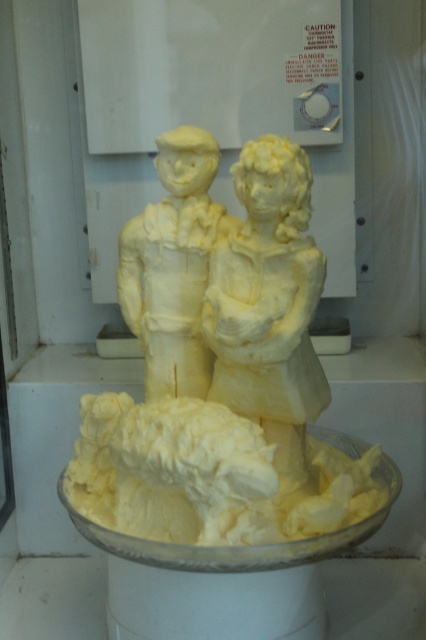
Find the location of a particular element. white creamy icing at lower center is located at coordinates (206, 476).

Can you confirm if white creamy icing at lower center is shorter than buttery yellow sculpture at center?

Indeed, white creamy icing at lower center has a lesser height compared to buttery yellow sculpture at center.

Locate an element on the screen. This screenshot has width=426, height=640. white creamy icing at lower center is located at coordinates (206, 476).

Who is more forward, [224,380] or [195,195]?

Point [224,380] is in front.

Is buttery yellow sculpture at center further to the viewer compared to yellow butter sculpture at center?

No, buttery yellow sculpture at center is in front of yellow butter sculpture at center.

This screenshot has width=426, height=640. What do you see at coordinates (268, 305) in the screenshot? I see `buttery yellow sculpture at center` at bounding box center [268, 305].

You are a GUI agent. You are given a task and a screenshot of the screen. Output one action in this format:
    pyautogui.click(x=<x>, y=<y>)
    Task: Click on the buttery yellow sculpture at center
    This screenshot has width=426, height=640.
    Given the screenshot: What is the action you would take?
    pyautogui.click(x=268, y=305)

Between white creamy icing at lower center and yellow butter sculpture at center, which one has less height?

With less height is white creamy icing at lower center.

Find the location of a particular element. Image resolution: width=426 pixels, height=640 pixels. white creamy icing at lower center is located at coordinates (206, 476).

Looking at this image, who is more forward, (100, 509) or (195, 209)?

Positioned in front is point (100, 509).

Locate an element on the screen. The height and width of the screenshot is (640, 426). white creamy icing at lower center is located at coordinates (206, 476).